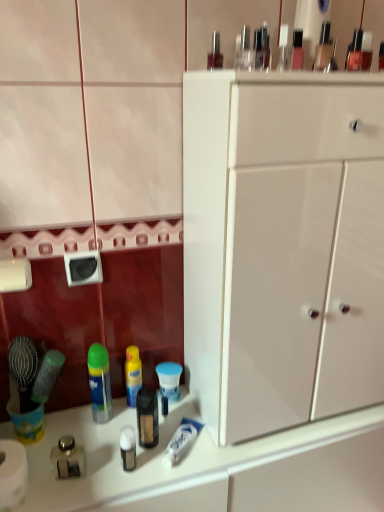
Find the location of a particular element. The width and height of the screenshot is (384, 512). free space in front of blue matte toothpaste tube at lower center, acting as the second toiletry starting from the bottom is located at coordinates (178, 460).